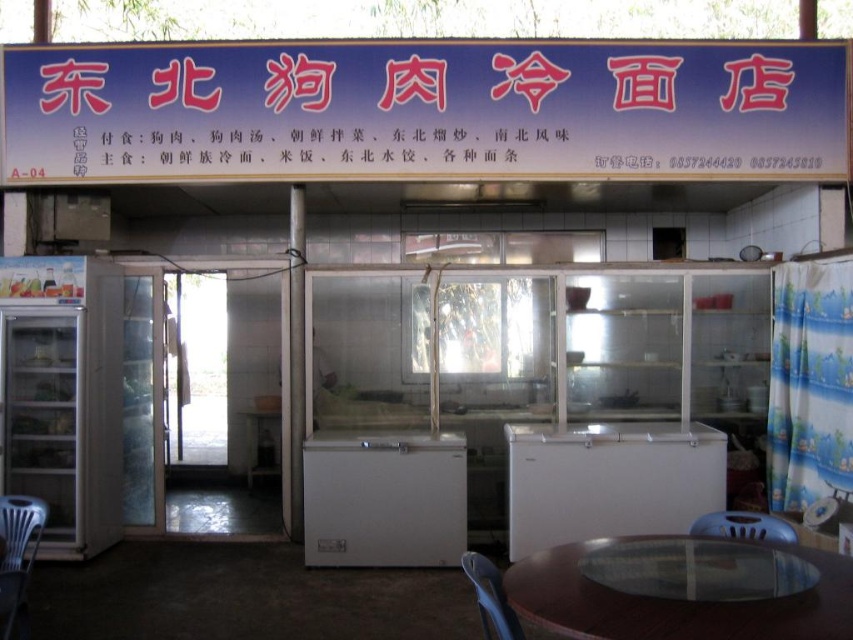
Can you confirm if blue plastic sign at upper center is positioned to the left of white matte freezer at center?

In fact, blue plastic sign at upper center is to the right of white matte freezer at center.

Between point (316, 52) and point (434, 483), which one is positioned behind?

The point (316, 52) is behind.

This screenshot has width=853, height=640. What are the coordinates of `blue plastic sign at upper center` in the screenshot? It's located at (426, 109).

Between blue plastic chair at lower center and blue plastic chair at lower right, which one appears on the left side from the viewer's perspective?

blue plastic chair at lower center

From the picture: Which is below, blue plastic chair at lower center or blue plastic chair at lower right?

blue plastic chair at lower center

Image resolution: width=853 pixels, height=640 pixels. Identify the location of blue plastic chair at lower center. (490, 596).

Is blue plastic sign at upper center in front of white plastic chair at lower left?

No, it is not.

You are a GUI agent. You are given a task and a screenshot of the screen. Output one action in this format:
    pyautogui.click(x=<x>, y=<y>)
    Task: Click on the blue plastic sign at upper center
    The width and height of the screenshot is (853, 640).
    Given the screenshot: What is the action you would take?
    click(x=426, y=109)

Where is `blue plastic sign at upper center`? blue plastic sign at upper center is located at coordinates (426, 109).